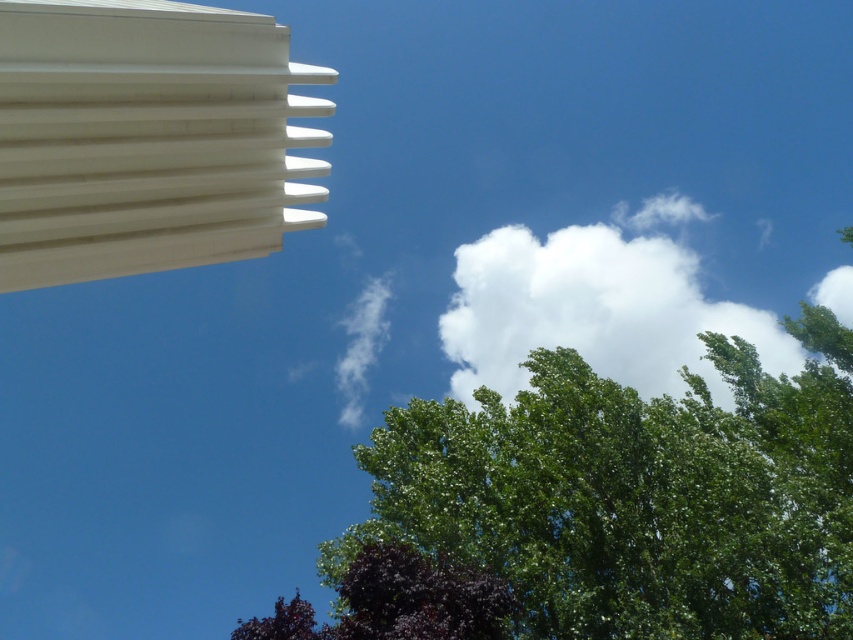
Does white fluffy cloud at upper center have a lesser width compared to dark purple leafy tree at lower center?

No, white fluffy cloud at upper center is not thinner than dark purple leafy tree at lower center.

Can you confirm if white fluffy cloud at upper center is bigger than dark purple leafy tree at lower center?

Yes.

Is point (582, 228) closer to camera compared to point (340, 595)?

No.

Identify the location of white fluffy cloud at upper center. (593, 310).